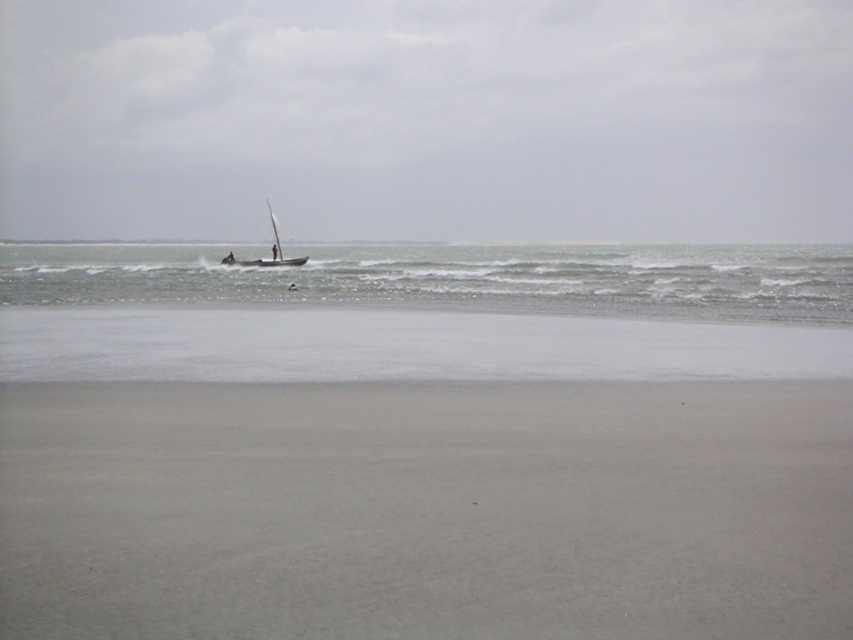
You are standing on the beach and see both the white matte sailboat at center and the wooden sailboat at center. Which boat is closer to you?

The white matte sailboat at center is 135.32 feet away from the wooden sailboat at center, but the question is about which is closer to you. Since both are at center, their distance from you would depend on their positions relative to each other. However, the given information only specifies the distance between them, not their individual distances from the observer. Therefore, we cannot determine which is closer based on the provided details.

You are a photographer standing on the beach looking at the white matte sailboat at center and the clear water at center. Which object is closer to the camera?

The white matte sailboat at center is above clear water at center, so it is closer to the camera.